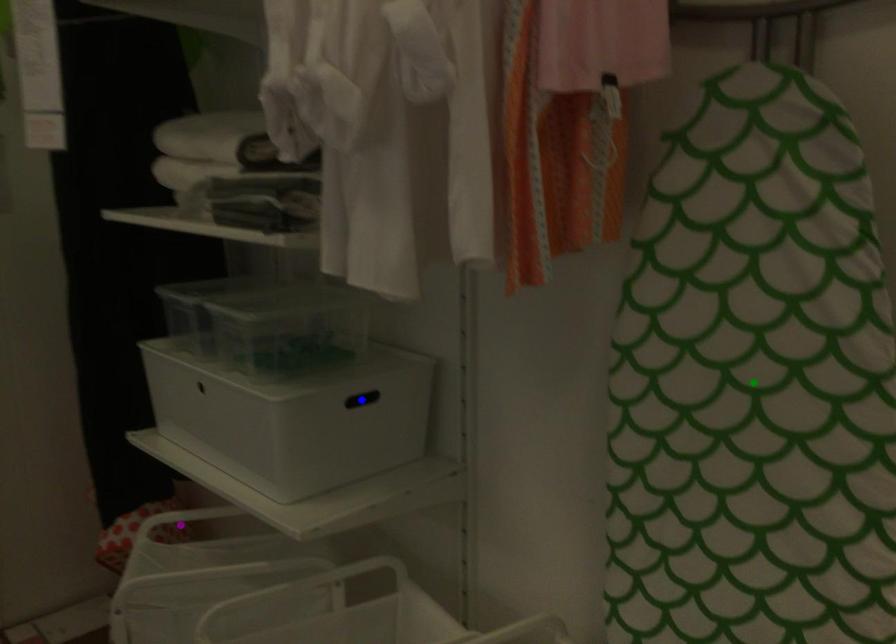
Order these from nearest to farthest:
green point, purple point, blue point

green point, blue point, purple point